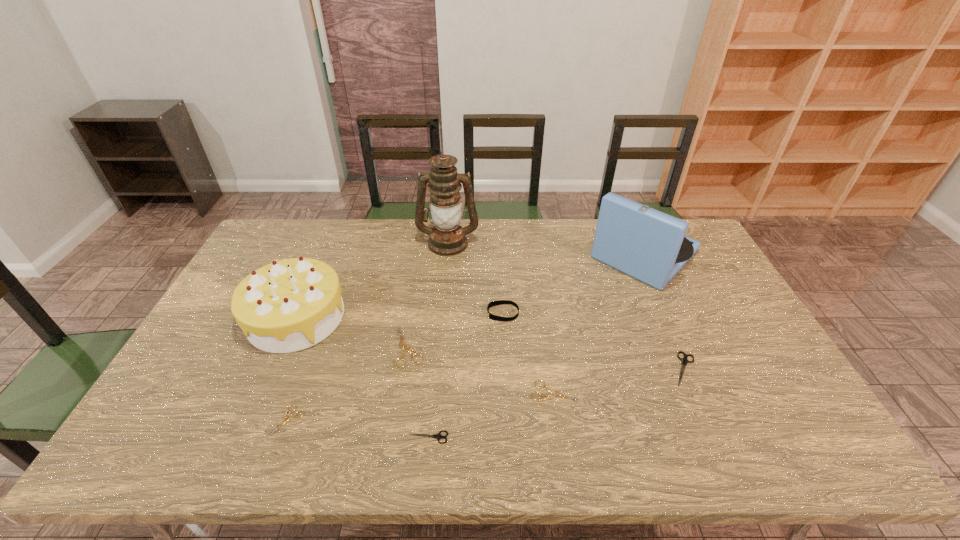
Locate an element on the screen. This screenshot has height=540, width=960. object located at the right edge is located at coordinates (646, 244).

Find the location of a particular element. object located in the far right corner section of the desktop is located at coordinates (646, 244).

Where is `free region at the far edge`? The height and width of the screenshot is (540, 960). free region at the far edge is located at coordinates (393, 221).

At what (x,y) coordinates should I click in order to perform the action: click on free region at the left edge of the desktop. Please return your answer as a coordinate pair (x, y). The width and height of the screenshot is (960, 540). Looking at the image, I should click on (202, 410).

Find the location of `vacant space at the right edge of the desktop`. vacant space at the right edge of the desktop is located at coordinates (712, 347).

Locate an element on the screen. free space at the far left corner of the desktop is located at coordinates (285, 236).

The image size is (960, 540). I want to click on vacant area between the tallest object and the shortest object, so 368,332.

At what (x,y) coordinates should I click in order to perform the action: click on free space between the farther black shears and the blue phonograph record. Please return your answer as a coordinate pair (x, y). Looking at the image, I should click on (664, 312).

The height and width of the screenshot is (540, 960). Find the location of `free spot between the nearer black shears and the sixth object from left to right`. free spot between the nearer black shears and the sixth object from left to right is located at coordinates (466, 375).

Where is `blank region between the tallest object and the birthday cake`? The height and width of the screenshot is (540, 960). blank region between the tallest object and the birthday cake is located at coordinates (372, 280).